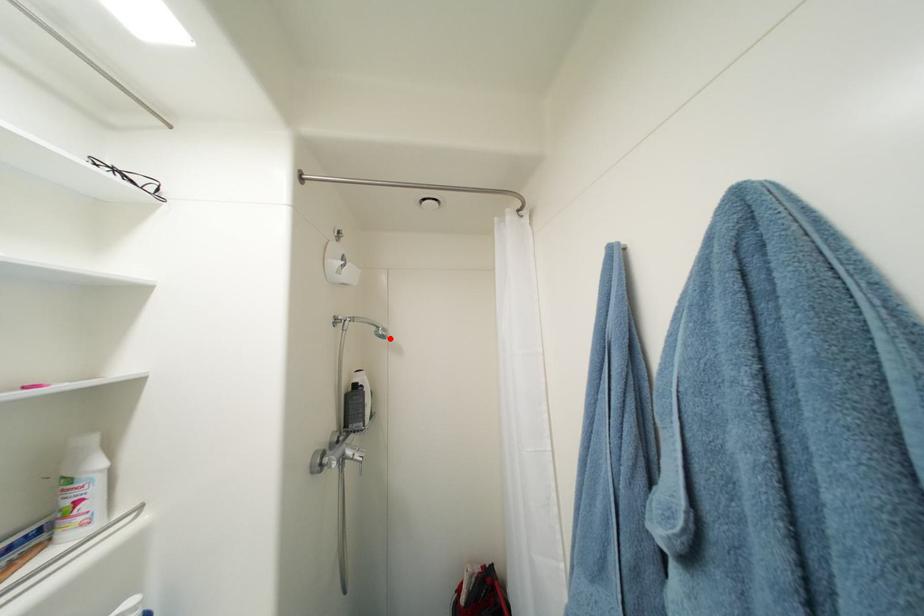
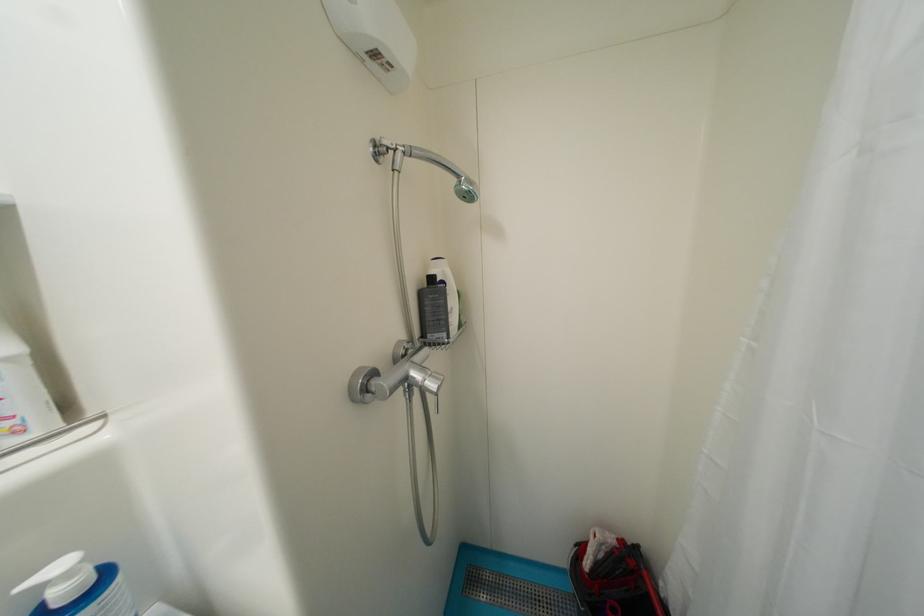
The point at the highlighted location is marked in the first image. Where is the corresponding point in the second image?

(476, 199)